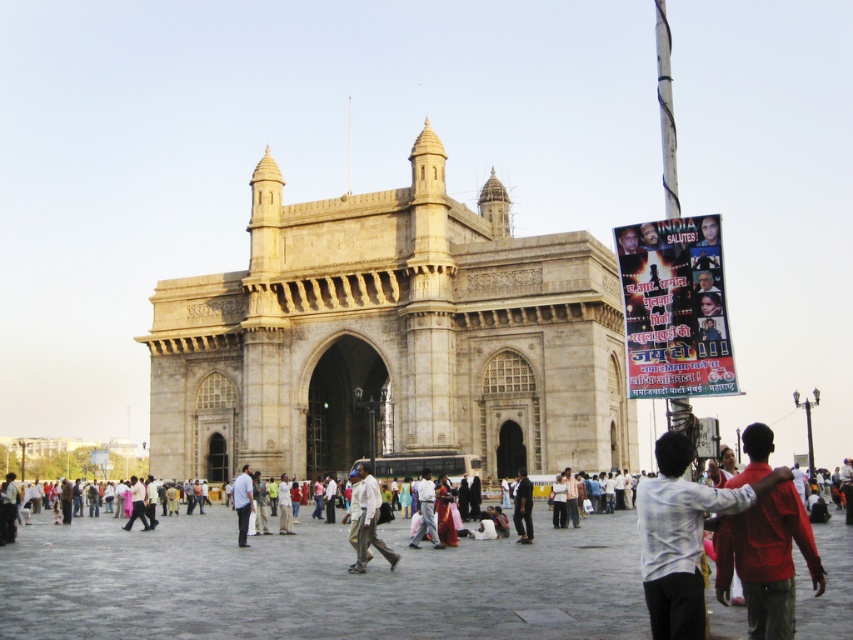
You are standing at the entrance of the Gateway of India and want to take a photo of the beige stone gateway of india at center. Where should you position yourself to capture the entire structure in your frame?

To capture the entire beige stone gateway of india at center in your frame, position yourself at a distance that allows the structure to fit within your camera viewfinder. Since the gateway is located at coordinates point (392, 340), ensure you are positioned far enough back to include all its architectural details without cropping any part of it.

Based on the photo, you are a tourist visiting the Gateway of India and want to take a photo that includes both the beige stone gateway of india at center and the dark blue fabric at center. Since you want the Gateway to be the main focus, which object should you place closer to the center of your camera frame?

The beige stone gateway of india at center should be placed closer to the center of your camera frame since it has a larger size compared to the dark blue fabric at center, making it the main focus.

You are a photographer standing in front of the Gateway of India monument. You notice a person wearing a red cotton shirt at lower right and another wearing light beige fabric pants at center. Which clothing item is covering the other in the image?

The red cotton shirt at lower right is positioned over the light beige fabric pants at center, so it is covering the pants.